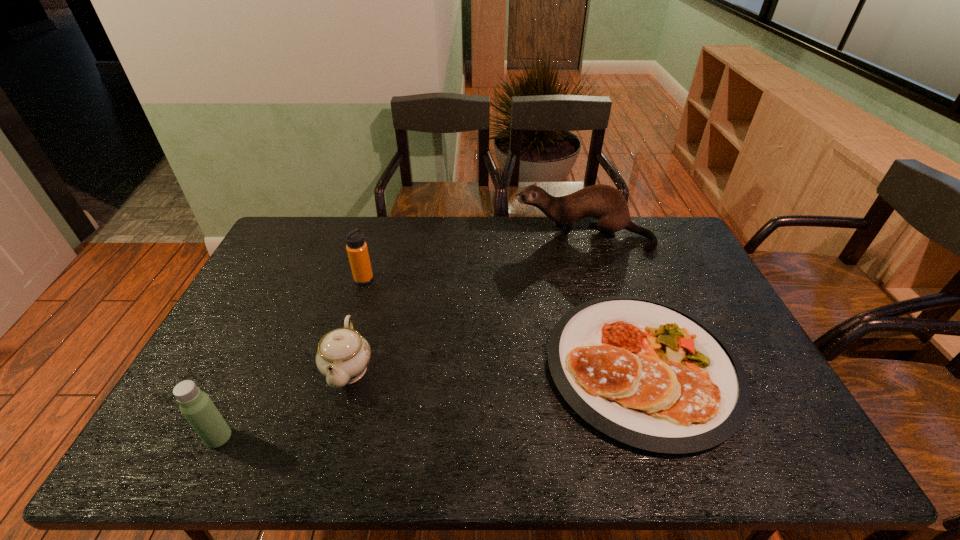
The height and width of the screenshot is (540, 960). I want to click on object present at the near left corner, so click(196, 406).

Image resolution: width=960 pixels, height=540 pixels. I want to click on object present at the far right corner, so click(603, 202).

Where is `object that is at the near right corner`? This screenshot has width=960, height=540. object that is at the near right corner is located at coordinates (647, 374).

The height and width of the screenshot is (540, 960). I want to click on free location at the far edge, so click(x=432, y=246).

This screenshot has width=960, height=540. I want to click on free space at the left edge, so tap(265, 266).

The image size is (960, 540). In the image, there is a desktop. In order to click on vacant space at the right edge in this screenshot , I will do `click(657, 270)`.

At what (x,y) coordinates should I click in order to perform the action: click on vacant area at the far left corner. Please return your answer as a coordinate pair (x, y). The image size is (960, 540). Looking at the image, I should click on (323, 218).

Locate an element on the screen. This screenshot has height=540, width=960. vacant region between the shortest object and the fourth tallest object is located at coordinates (495, 367).

Locate an element on the screen. The width and height of the screenshot is (960, 540). free spot between the chinaware and the farthest object is located at coordinates (466, 302).

The image size is (960, 540). I want to click on free space between the fourth nearest object and the ferret, so click(x=473, y=258).